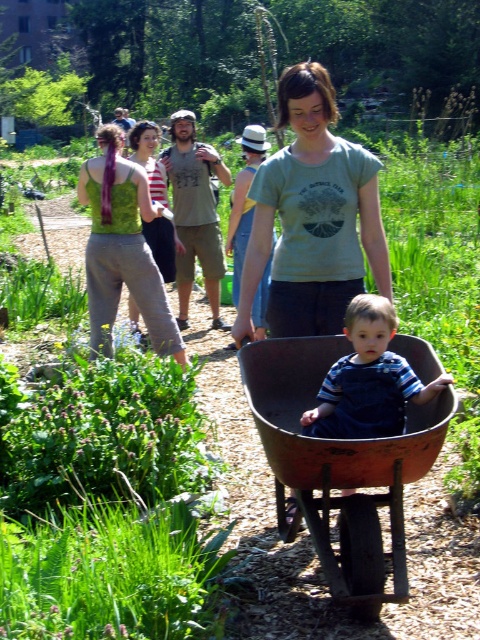
Describe the element at coordinates (338, 467) in the screenshot. Image resolution: width=480 pixels, height=640 pixels. I see `rusty metal wheelbarrow at center` at that location.

Between rusty metal wheelbarrow at center and green matte tank top at center, which one is positioned higher?

green matte tank top at center

This screenshot has height=640, width=480. Find the location of `rusty metal wheelbarrow at center`. rusty metal wheelbarrow at center is located at coordinates (338, 467).

Find the location of `rusty metal wheelbarrow at center`. rusty metal wheelbarrow at center is located at coordinates (338, 467).

Does green t-shirt at center have a greater height compared to green matte tank top at center?

No.

Which is in front, point (275, 333) or point (131, 320)?

Positioned in front is point (275, 333).

Identify the location of green t-shirt at center. (312, 218).

Who is more distant from viewer, (373, 556) or (256, 182)?

Positioned behind is point (256, 182).

Looking at this image, can you confirm if rusty metal wheelbarrow at center is positioned below green t-shirt at center?

Correct, rusty metal wheelbarrow at center is located below green t-shirt at center.

Where is `rusty metal wheelbarrow at center`? rusty metal wheelbarrow at center is located at coordinates (338, 467).

Where is `rusty metal wheelbarrow at center`? rusty metal wheelbarrow at center is located at coordinates (338, 467).